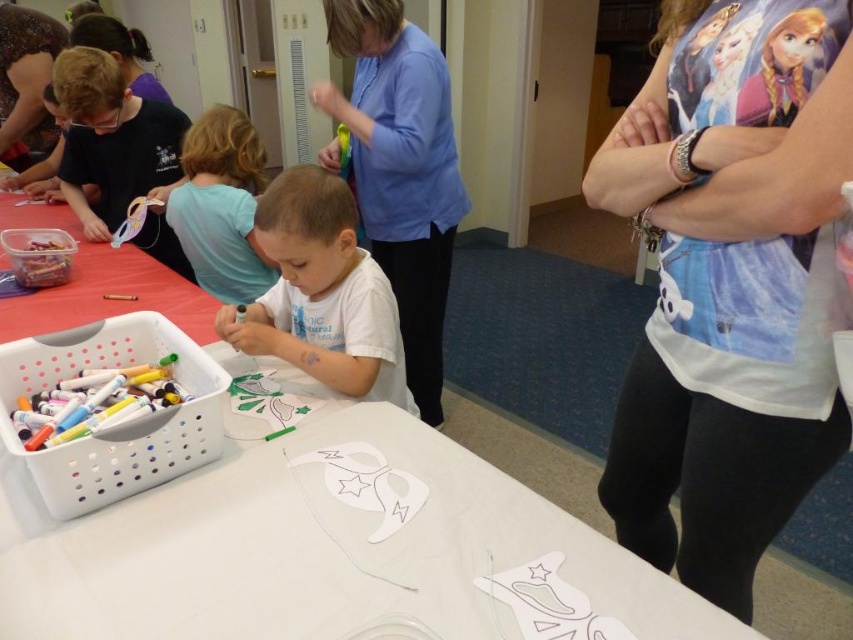
Who is lower down, white printed shirt at upper right or blue shirt at upper center?

white printed shirt at upper right

Can you confirm if white printed shirt at upper right is taller than blue shirt at upper center?

Incorrect, white printed shirt at upper right's height is not larger of blue shirt at upper center's.

The height and width of the screenshot is (640, 853). I want to click on white printed shirt at upper right, so click(x=730, y=284).

At what (x,y) coordinates should I click in order to perform the action: click on white printed shirt at upper right. Please return your answer as a coordinate pair (x, y). The image size is (853, 640). Looking at the image, I should click on (730, 284).

Is white paper table at center taller than white matte shirt at center?

In fact, white paper table at center may be shorter than white matte shirt at center.

Is point (44, 605) positioned before point (366, 269)?

Yes, point (44, 605) is closer to viewer.

The image size is (853, 640). I want to click on white paper table at center, so click(x=323, y=552).

Between point (216, 605) and point (173, 188), which one is positioned in front?

Point (216, 605) is in front.

How distant is white paper table at center from light blue shirt at upper left?

white paper table at center and light blue shirt at upper left are 1.02 meters apart from each other.

Is point (42, 508) positioned after point (271, 264)?

That is False.

The height and width of the screenshot is (640, 853). What are the coordinates of `white paper table at center` in the screenshot? It's located at (323, 552).